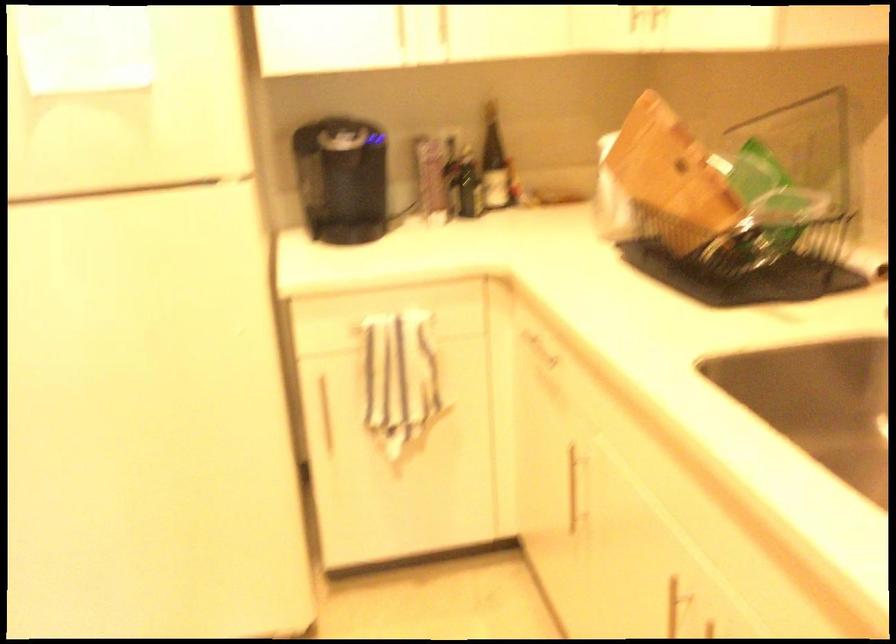
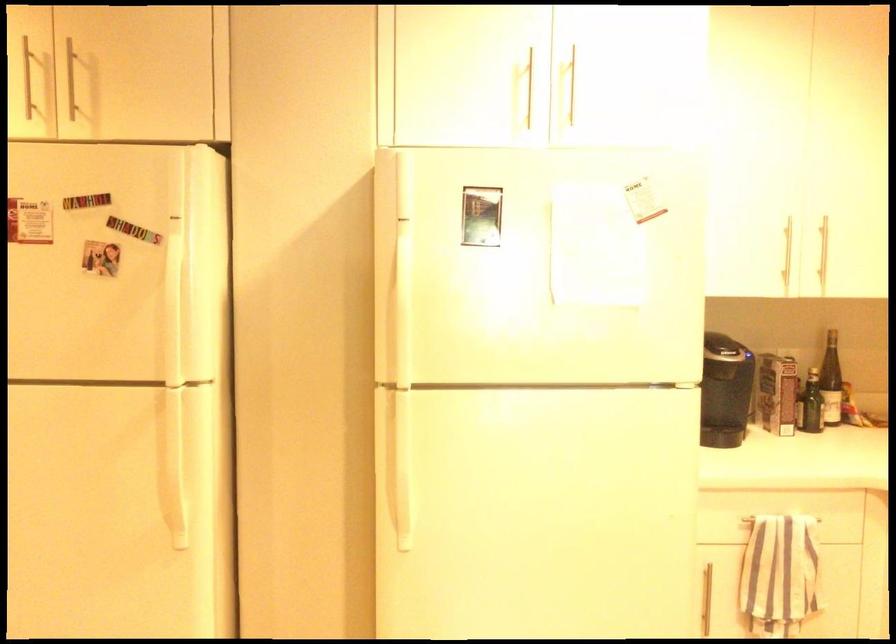
In the second image, find the point that corresponds to point 398,317 in the first image.

(781, 518)